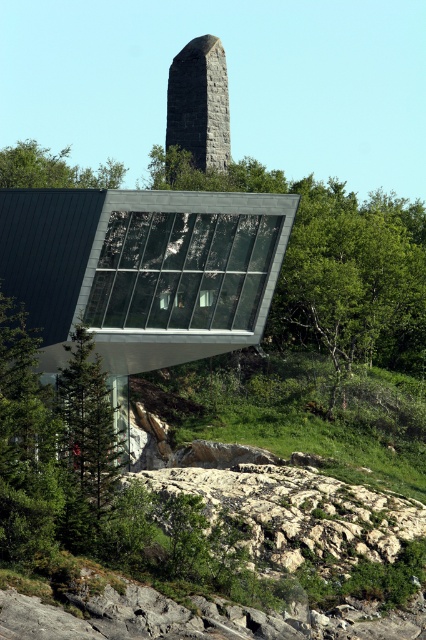
Question: Among these points, which one is farthest from the camera?

Choices:
 (A) (17, 179)
 (B) (199, 168)

Answer: (B)

Question: Is the position of granite stone obelisk at upper center more distant than that of green leafy tree at upper left?

Choices:
 (A) yes
 (B) no

Answer: (A)

Question: Can you confirm if granite stone obelisk at upper center is smaller than green leafy tree at upper left?

Choices:
 (A) yes
 (B) no

Answer: (A)

Question: Which point is farther to the camera?

Choices:
 (A) granite stone obelisk at upper center
 (B) green leafy tree at upper left

Answer: (A)

Question: From the image, what is the correct spatial relationship of granite stone obelisk at upper center in relation to green leafy tree at upper left?

Choices:
 (A) above
 (B) below

Answer: (B)